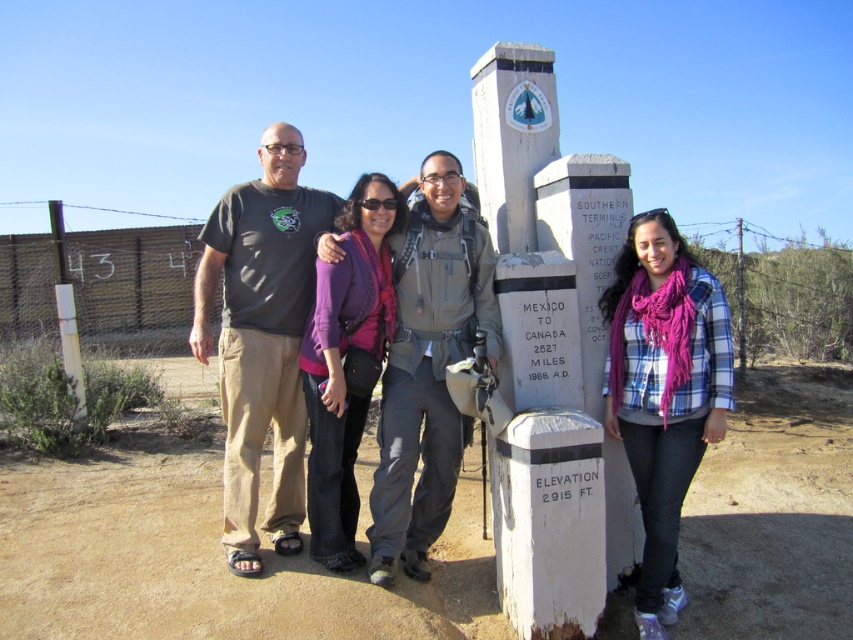
Question: Is dark gray t-shirt at center below plaid shirt at center?

Choices:
 (A) no
 (B) yes

Answer: (A)

Question: Can you confirm if brown sandy dirt at lower center is positioned to the right of dark gray t-shirt at center?

Choices:
 (A) no
 (B) yes

Answer: (B)

Question: Which object is farther from the camera taking this photo?

Choices:
 (A) plaid shirt at center
 (B) dark gray t-shirt at center

Answer: (B)

Question: Is brown sandy dirt at lower center positioned at the back of plaid shirt at center?

Choices:
 (A) no
 (B) yes

Answer: (B)

Question: Which is nearer to the brown sandy dirt at lower center?

Choices:
 (A) plaid shirt at center
 (B) dark gray t-shirt at center

Answer: (A)

Question: Estimate the real-world distances between objects in this image. Which object is closer to the plaid shirt at center?

Choices:
 (A) brown sandy dirt at lower center
 (B) dark gray t-shirt at center

Answer: (A)